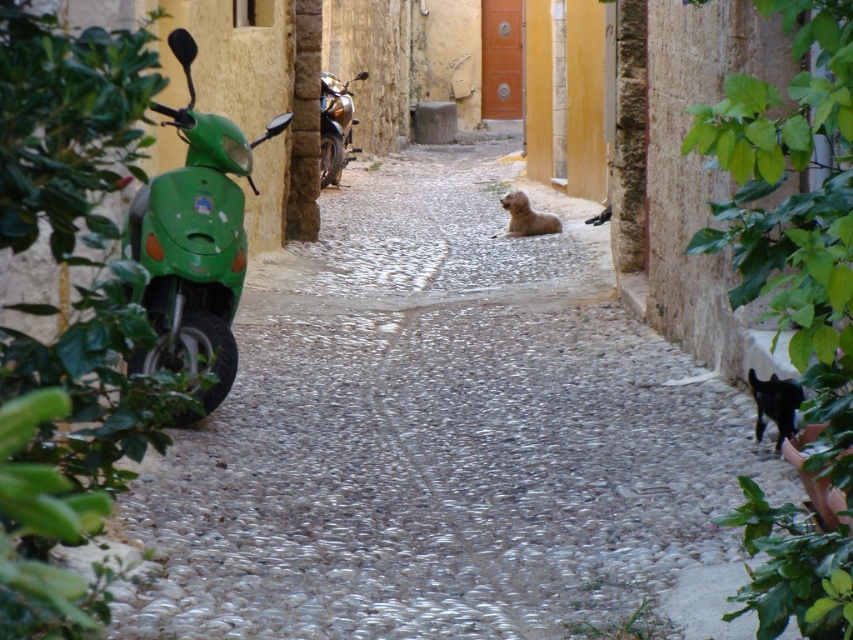
Is green matte scooter at left thinner than black glossy cat at lower right?

In fact, green matte scooter at left might be wider than black glossy cat at lower right.

Locate an element on the screen. This screenshot has width=853, height=640. green matte scooter at left is located at coordinates (194, 241).

Is point (231, 372) farther from viewer compared to point (335, 109)?

No, it is in front of (335, 109).

Which is more to the right, green matte scooter at left or metallic gold motorcycle at center?

Positioned to the right is green matte scooter at left.

The image size is (853, 640). What do you see at coordinates (194, 241) in the screenshot?
I see `green matte scooter at left` at bounding box center [194, 241].

Where is `green matte scooter at left`? green matte scooter at left is located at coordinates (194, 241).

The height and width of the screenshot is (640, 853). What do you see at coordinates (335, 125) in the screenshot?
I see `metallic gold motorcycle at center` at bounding box center [335, 125].

In the scene shown: Does metallic gold motorcycle at center appear on the left side of brown furry dog at center?

Correct, you'll find metallic gold motorcycle at center to the left of brown furry dog at center.

Which is behind, point (332, 106) or point (512, 228)?

Positioned behind is point (332, 106).

Locate an element on the screen. The height and width of the screenshot is (640, 853). metallic gold motorcycle at center is located at coordinates (335, 125).